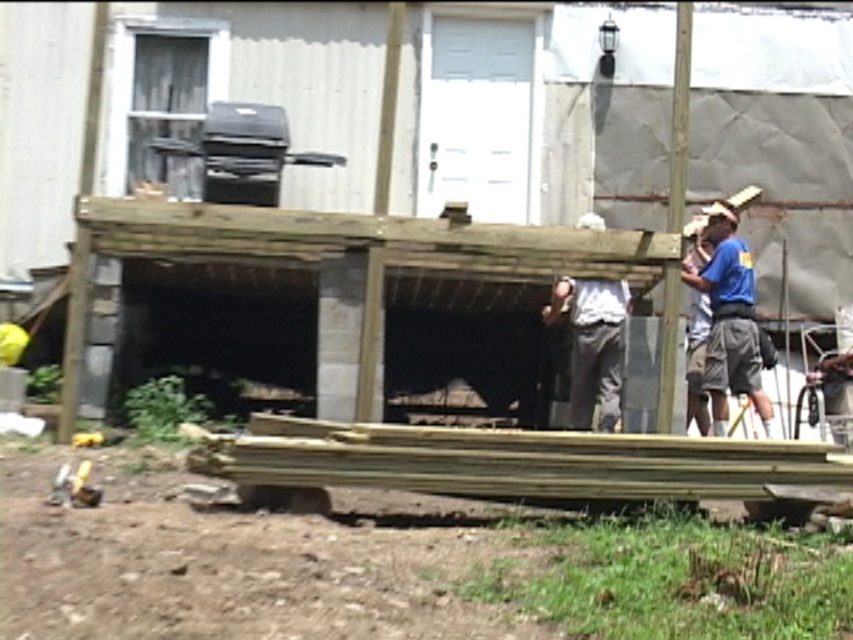
Question: Does blue fabric shirt at right appear over white cotton shirt at center?

Choices:
 (A) no
 (B) yes

Answer: (B)

Question: In this image, where is blue fabric shirt at right located relative to white cotton shirt at center?

Choices:
 (A) right
 (B) left

Answer: (A)

Question: From the image, what is the correct spatial relationship of blue fabric shirt at right in relation to white cotton shirt at center?

Choices:
 (A) below
 (B) above

Answer: (B)